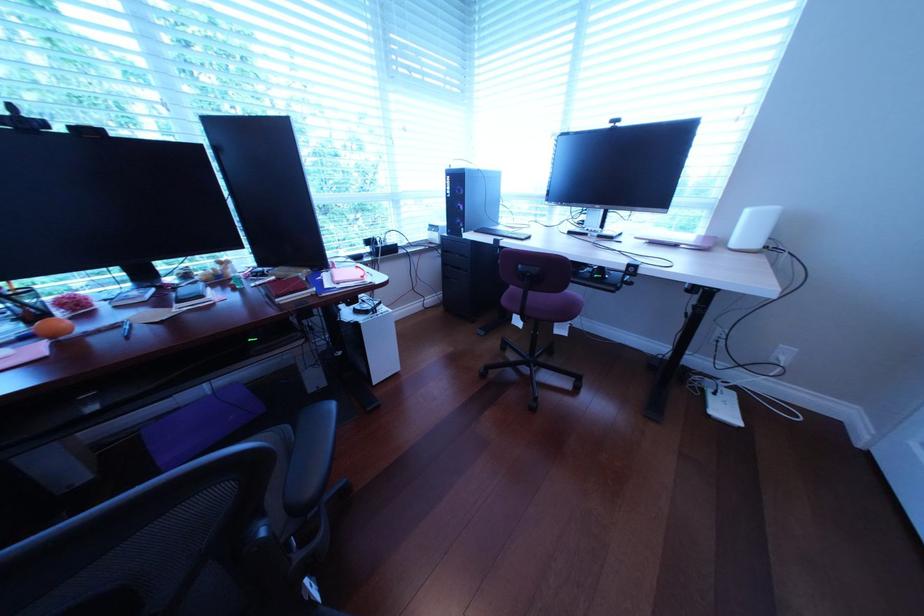
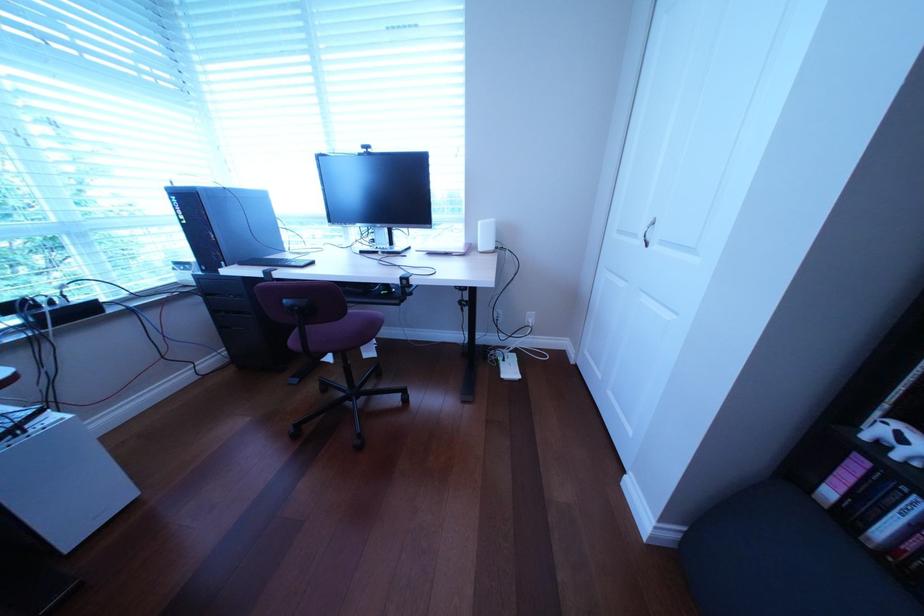
Question: How did the camera likely rotate?

Choices:
 (A) Left
 (B) Right
 (C) Up
 (D) Down

Answer: (B)